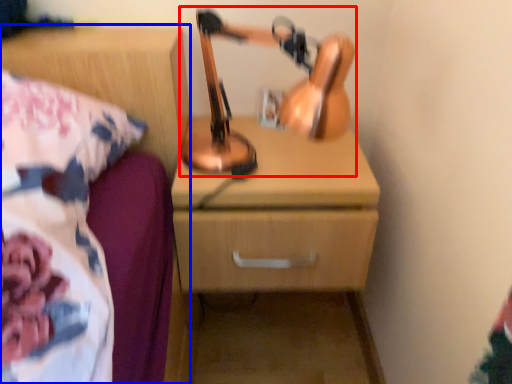
Question: Among these objects, which one is nearest to the camera, table lamp (highlighted by a red box) or nightstand (highlighted by a blue box)?

Choices:
 (A) table lamp
 (B) nightstand

Answer: (B)